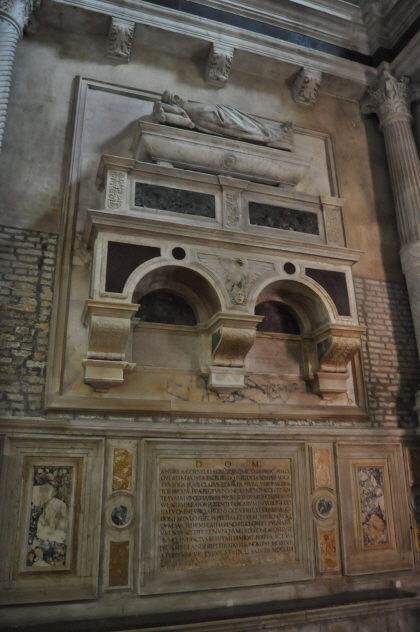
This screenshot has width=420, height=632. Find the location of `stonework of a man lying down on a bed and pillow`. stonework of a man lying down on a bed and pillow is located at coordinates (216, 112).